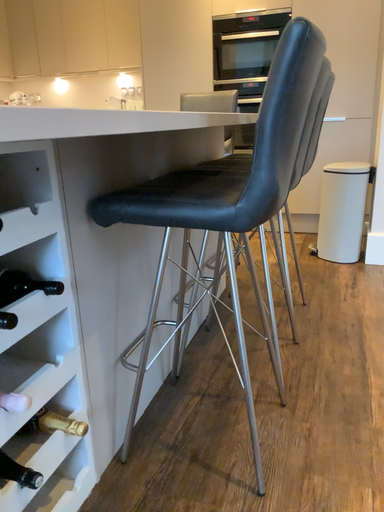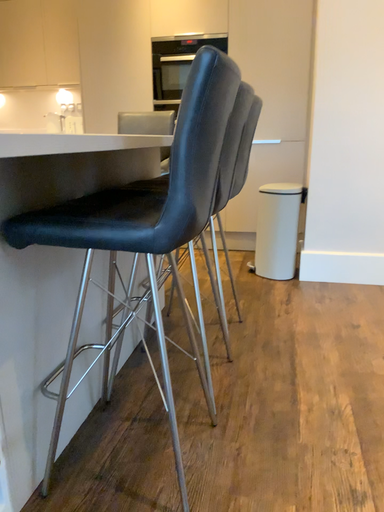
Question: Which way did the camera rotate in the video?

Choices:
 (A) rotated left
 (B) rotated right

Answer: (B)